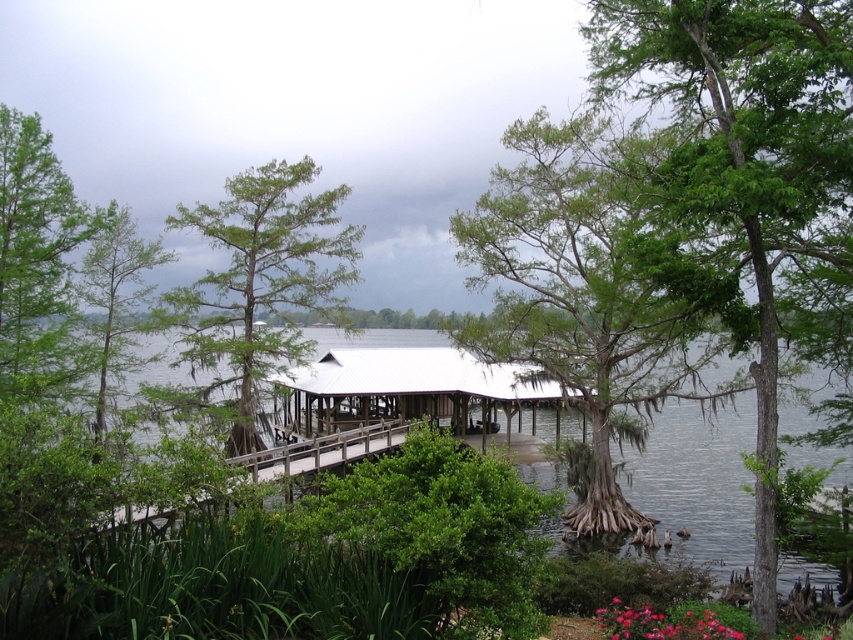
Question: Which of the following is the closest to the observer?

Choices:
 (A) clear water at center
 (B) green rough bark tree at upper center

Answer: (B)

Question: Among these points, which one is farthest from the camera?

Choices:
 (A) (700, 141)
 (B) (648, 492)
 (C) (135, 237)
 (D) (670, 344)

Answer: (C)

Question: Which is nearer to the clear water at center?

Choices:
 (A) green mossy tree at center
 (B) white wooden hut at center

Answer: (B)

Question: Is green rough bark tree at upper center positioned in front of green matte tree at left?

Choices:
 (A) yes
 (B) no

Answer: (A)

Question: In this image, where is white wooden hut at center located relative to green matte tree at left?

Choices:
 (A) above
 (B) below

Answer: (B)

Question: Can you confirm if green mossy tree at center is positioned above green matte tree at center?

Choices:
 (A) no
 (B) yes

Answer: (A)